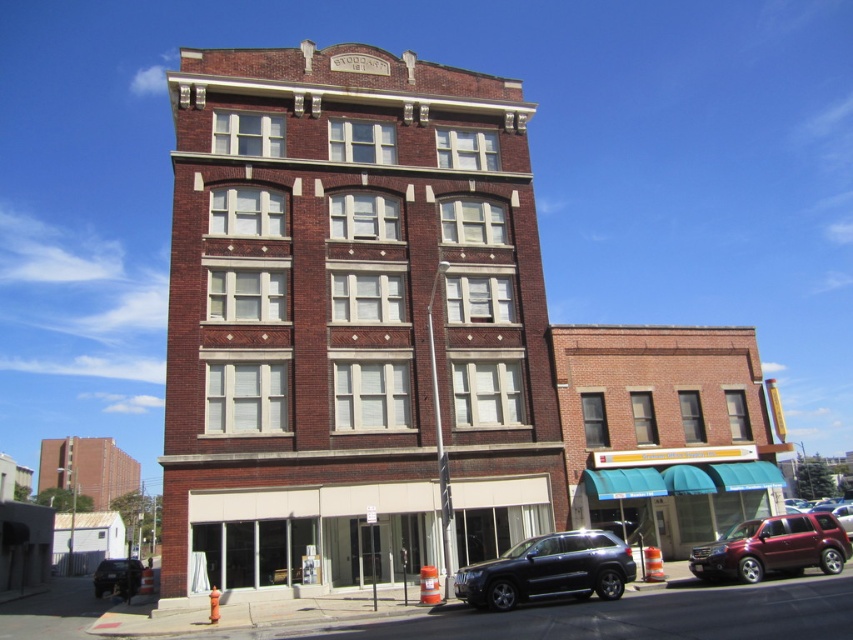
Question: Which point appears closest to the camera in this image?

Choices:
 (A) [109, 588]
 (B) [828, 547]
 (C) [531, 563]

Answer: (C)

Question: Can you confirm if satin burgundy suv at lower right is wider than matte black suv at lower left?

Choices:
 (A) yes
 (B) no

Answer: (B)

Question: Which of the following is the farthest from the observer?

Choices:
 (A) satin burgundy suv at lower right
 (B) black matte suv at lower center
 (C) matte black suv at lower left

Answer: (C)

Question: Is black matte suv at lower center below satin burgundy suv at lower right?

Choices:
 (A) no
 (B) yes

Answer: (A)

Question: Does black matte suv at lower center have a lesser width compared to matte black suv at lower left?

Choices:
 (A) yes
 (B) no

Answer: (A)

Question: Which point is farther from the camera taking this photo?

Choices:
 (A) (703, 566)
 (B) (96, 570)

Answer: (B)